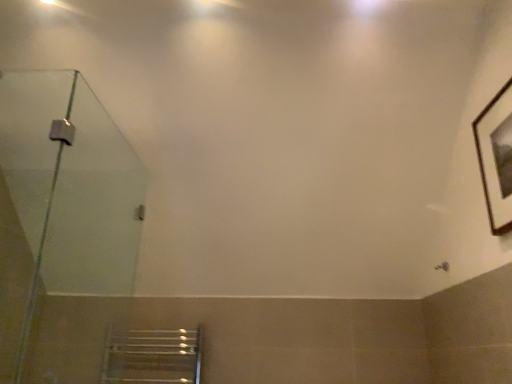
Question: Relative to brown wooden picture frame at upper right, is transparent glass shower door at left in front or behind?

Choices:
 (A) behind
 (B) front

Answer: (B)

Question: Which is correct: transparent glass shower door at left is inside brown wooden picture frame at upper right, or outside of it?

Choices:
 (A) outside
 (B) inside

Answer: (A)

Question: In terms of width, does transparent glass shower door at left look wider or thinner when compared to brown wooden picture frame at upper right?

Choices:
 (A) thin
 (B) wide

Answer: (B)

Question: Is brown wooden picture frame at upper right taller or shorter than transparent glass shower door at left?

Choices:
 (A) tall
 (B) short

Answer: (B)

Question: Is brown wooden picture frame at upper right situated inside transparent glass shower door at left or outside?

Choices:
 (A) outside
 (B) inside

Answer: (A)

Question: Is point (477, 127) closer or farther from the camera than point (80, 233)?

Choices:
 (A) farther
 (B) closer

Answer: (B)

Question: Would you say brown wooden picture frame at upper right is to the left or to the right of transparent glass shower door at left in the picture?

Choices:
 (A) right
 (B) left

Answer: (A)